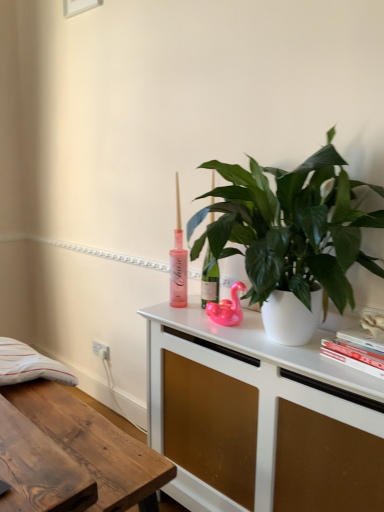
Locate an element on the screen. vacant space situated above wooden desk at lower left (from a real-world perspective) is located at coordinates (69, 417).